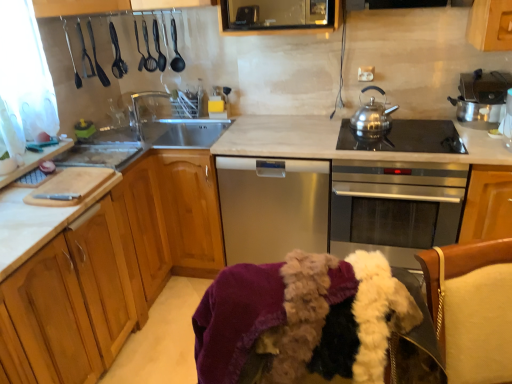
Locate an element on the screen. The image size is (512, 384). vacant space situated on the left part of transparent glass tap at center is located at coordinates point(133,137).